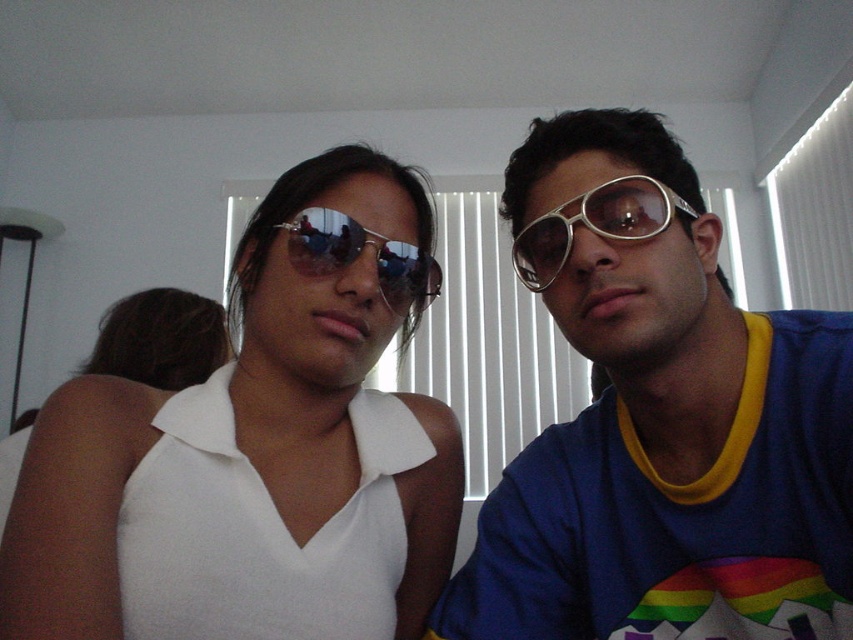
Can you confirm if metallic gold sunglasses at upper right is positioned to the left of sunglasses at center?

In fact, metallic gold sunglasses at upper right is to the right of sunglasses at center.

Identify the location of metallic gold sunglasses at upper right. [x=660, y=420].

In order to click on metallic gold sunglasses at upper right in this screenshot , I will do `click(660, 420)`.

How far apart are metallic gold sunglasses at upper right and metallic silver goggles at center?

A distance of 5.53 inches exists between metallic gold sunglasses at upper right and metallic silver goggles at center.

Between metallic gold sunglasses at upper right and metallic silver goggles at center, which one is positioned lower?

metallic gold sunglasses at upper right is lower down.

What do you see at coordinates (660, 420) in the screenshot?
I see `metallic gold sunglasses at upper right` at bounding box center [660, 420].

Find the location of `metallic gold sunglasses at upper right`. metallic gold sunglasses at upper right is located at coordinates (660, 420).

Which is behind, point (598, 186) or point (328, 209)?

Point (328, 209)

Who is positioned more to the left, metallic silver goggles at center or sunglasses at center?

sunglasses at center is more to the left.

Is point (624, 212) positioned behind point (389, 260)?

No, (624, 212) is in front of (389, 260).

In order to click on metallic silver goggles at center in this screenshot , I will do click(x=595, y=225).